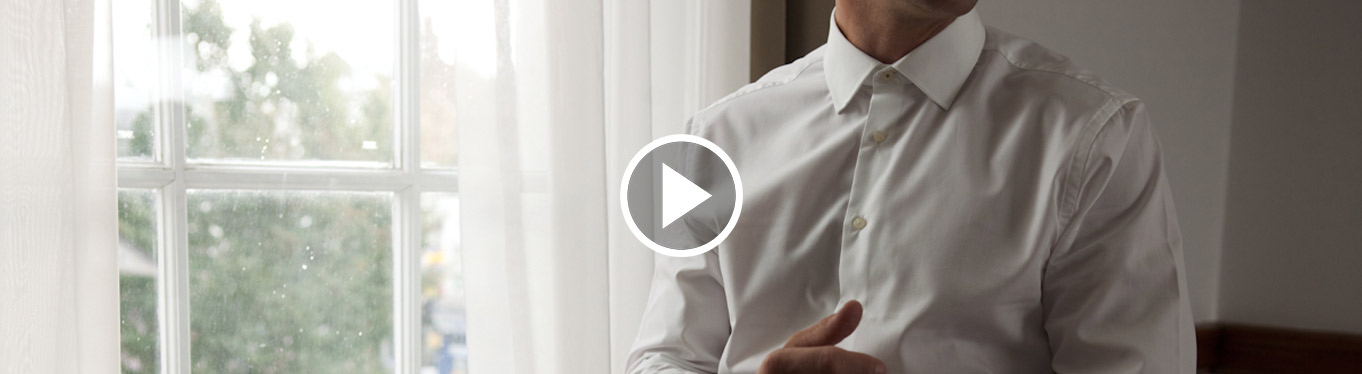
Identify the location of curtain that is white. (580, 94).